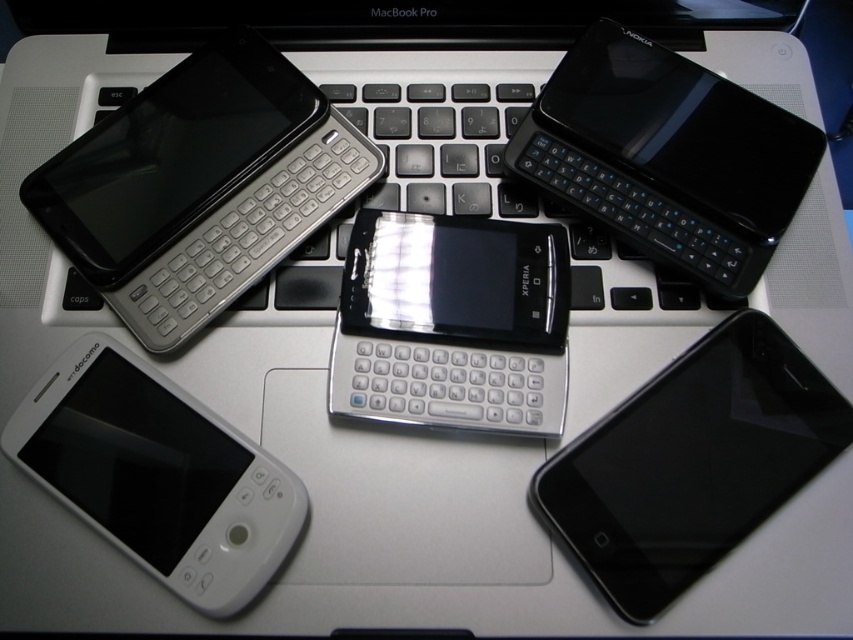
You are looking at the image of the MacBook Pro with devices on top. There are two points marked in the scene. Which point, point 1 at coordinates point (x=682, y=419) or point 2 at coordinates point (x=218, y=102), is closer to you?

Point 1 at coordinates point (x=682, y=419) is closer to the viewer than point 2 at coordinates point (x=218, y=102).

You are organizing a display of vintage tech gadgets. You have two phones to place on a shelf. The black glossy smartphone at bottom right and the matte silver phone at upper left. Which phone should you choose if you want to save space on the shelf?

The black glossy smartphone at bottom right occupies less space than the matte silver phone at upper left, so it is the better choice for saving space on the shelf.